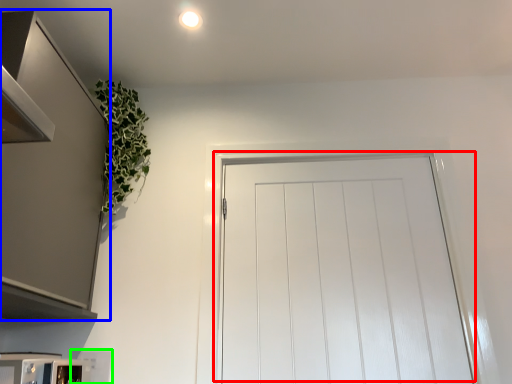
Question: Based on their relative distances, which object is nearer to door (highlighted by a red box)? Choose from cabinetry (highlighted by a blue box) and appliance (highlighted by a green box).

Choices:
 (A) cabinetry
 (B) appliance

Answer: (A)